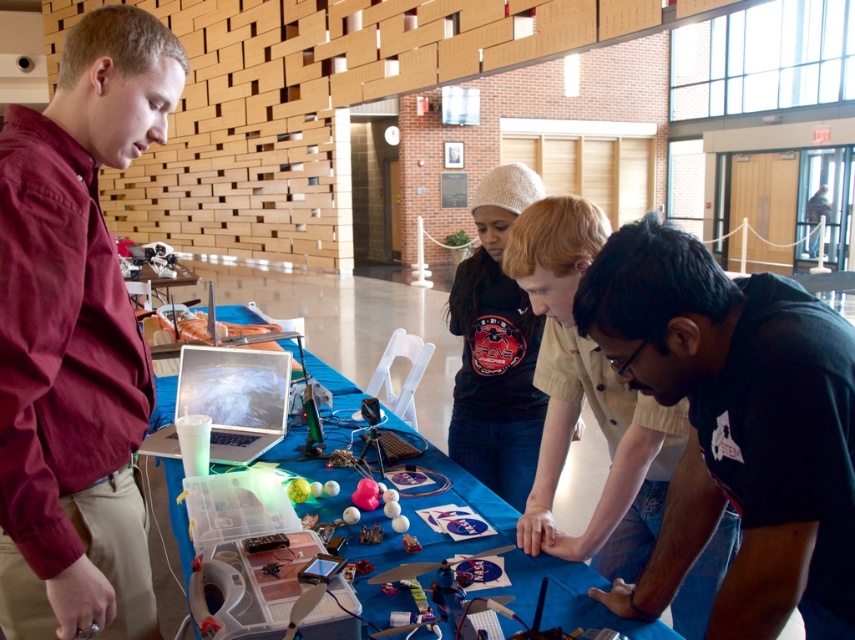
In the scene shown: Is the position of matte black shirt at center more distant than that of dark blue sweater at center?

No, it is not.

Is point (561, 282) positioned behind point (498, 474)?

That is False.

The width and height of the screenshot is (855, 640). I want to click on matte black shirt at center, so click(x=587, y=401).

Does maroon shirt at left have a larger size compared to shiny silver laptop at center?

Yes, maroon shirt at left is bigger than shiny silver laptop at center.

Can you confirm if maroon shirt at left is positioned below shiny silver laptop at center?

Incorrect, maroon shirt at left is not positioned below shiny silver laptop at center.

I want to click on maroon shirt at left, so click(75, 339).

Can you confirm if dark blue sweater at center is positioned to the right of shiny silver laptop at center?

Correct, you'll find dark blue sweater at center to the right of shiny silver laptop at center.

Measure the distance between point (500, 433) and camera.

They are 2.13 meters apart.

Find the location of a particular element. Image resolution: width=855 pixels, height=640 pixels. dark blue sweater at center is located at coordinates (496, 348).